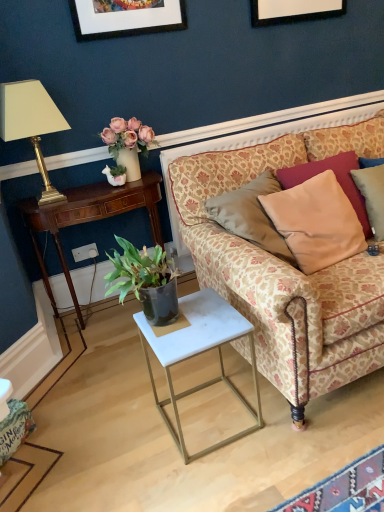
Question: From the image's perspective, is mahogany wood desk at left located above or below beige fabric pillow at upper right, which is the second pillow in back-to-front order?

Choices:
 (A) above
 (B) below

Answer: (B)

Question: From a real-world perspective, is mahogany wood desk at left above or below beige fabric pillow at upper right, which is the second pillow in back-to-front order?

Choices:
 (A) above
 (B) below

Answer: (B)

Question: Which of these objects is positioned closest to the white fabric lampshade at left?

Choices:
 (A) patterned fabric couch at right
 (B) white plastic power outlet at lower left
 (C) beige fabric pillow at right, the second pillow positioned from the front
 (D) green matte houseplant at upper left
 (E) white marble table at lower center

Answer: (D)

Question: Estimate the real-world distances between objects in this image. Which object is farther from the mahogany wood desk at left?

Choices:
 (A) white plastic power outlet at lower left
 (B) beige fabric pillow at right, the second pillow positioned from the front
 (C) green matte houseplant at upper left
 (D) beige fabric pillow at upper right, marked as the first pillow in a front-to-back arrangement
 (E) white fabric lampshade at left

Answer: (B)